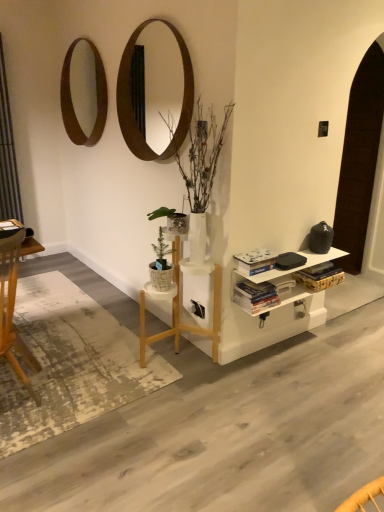
Image resolution: width=384 pixels, height=512 pixels. I want to click on vacant location below white wood table at center (from a real-world perspective), so click(x=177, y=355).